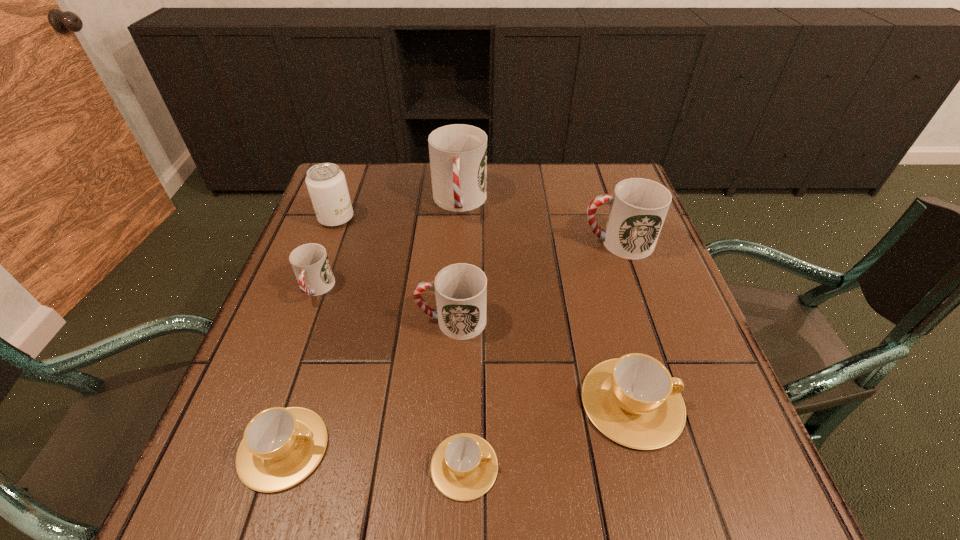
Identify which red cup is the second closest to the biggest brown cup. Please provide its 2D coordinates. Your answer should be formatted as a tuple, i.e. [(x, y)], where the tuple contains the x and y coordinates of a point satisfying the conditions above.

[(639, 206)]

At what (x,y) coordinates should I click in order to perform the action: click on red cup that is the second closest to the third biggest red cup. Please return your answer as a coordinate pair (x, y). This screenshot has width=960, height=540. Looking at the image, I should click on (458, 153).

Locate an element on the screen. brown cup that is the second nearest to the soda can is located at coordinates (464, 466).

Locate an element on the screen. This screenshot has width=960, height=540. the closest brown cup to the smallest brown cup is located at coordinates (633, 400).

Identify the location of free space in the image that satisfies the following two spatial constraints: 1. on the side of the rightmost red cup where the handle is located; 2. on the side of the tallest cup where the handle is located. (604, 202).